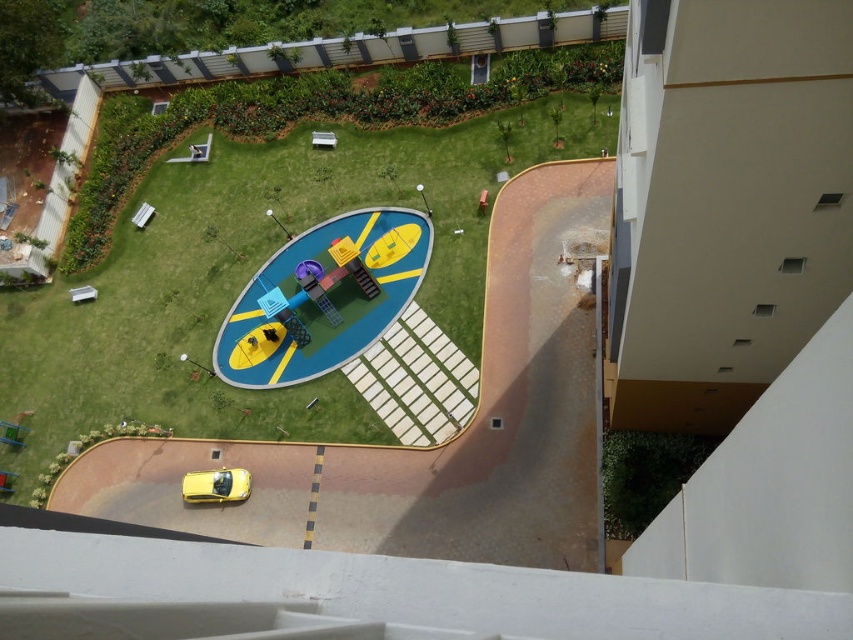
Question: Which point is closer to the camera taking this photo?

Choices:
 (A) pyautogui.click(x=221, y=497)
 (B) pyautogui.click(x=144, y=298)

Answer: (A)

Question: In this image, where is green grass at center located relative to yellow matte car at lower left?

Choices:
 (A) left
 (B) right

Answer: (B)

Question: Which object is farther from the camera taking this photo?

Choices:
 (A) yellow matte car at lower left
 (B) green grass at center

Answer: (A)

Question: Can you confirm if green grass at center is positioned above yellow matte car at lower left?

Choices:
 (A) yes
 (B) no

Answer: (A)

Question: Which point is closer to the camera?

Choices:
 (A) green grass at center
 (B) yellow matte car at lower left

Answer: (A)

Question: Can you confirm if green grass at center is wider than yellow matte car at lower left?

Choices:
 (A) no
 (B) yes

Answer: (B)